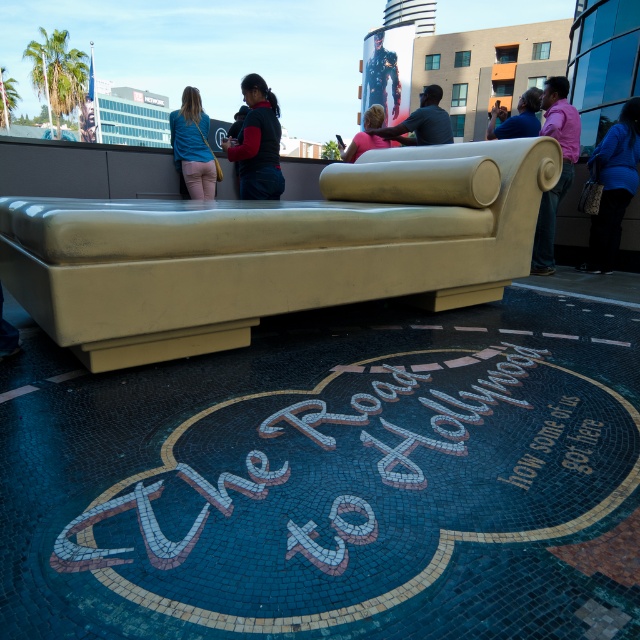
From the picture: Who is positioned more to the left, pink matte shirt at upper right or matte black camera at upper center?

From the viewer's perspective, matte black camera at upper center appears more on the left side.

Is point (554, 134) farther from camera compared to point (520, 115)?

No, it is not.

Locate an element on the screen. pink matte shirt at upper right is located at coordinates (561, 168).

You are a GUI agent. You are given a task and a screenshot of the screen. Output one action in this format:
    pyautogui.click(x=<x>, y=<y>)
    Task: Click on the pink matte shirt at upper right
    The image size is (640, 640).
    Given the screenshot: What is the action you would take?
    pyautogui.click(x=561, y=168)

Is matte black camera at upper center thinner than pink fabric couch at center?

Correct, matte black camera at upper center's width is less than pink fabric couch at center's.

Is matte black camera at upper center shorter than pink fabric couch at center?

Yes, matte black camera at upper center is shorter than pink fabric couch at center.

Is point (531, 116) farther from viewer compared to point (353, 161)?

No, it is not.

This screenshot has height=640, width=640. I want to click on matte black camera at upper center, so click(x=516, y=116).

Does matte black jacket at center have a greater width compared to matte black camera at upper center?

Yes, matte black jacket at center is wider than matte black camera at upper center.

Does point (252, 173) lie in front of point (531, 108)?

Yes.

Is point (262, 161) positioned after point (529, 116)?

No, it is in front of (529, 116).

This screenshot has width=640, height=640. Find the location of `matte black jacket at center`. matte black jacket at center is located at coordinates (257, 141).